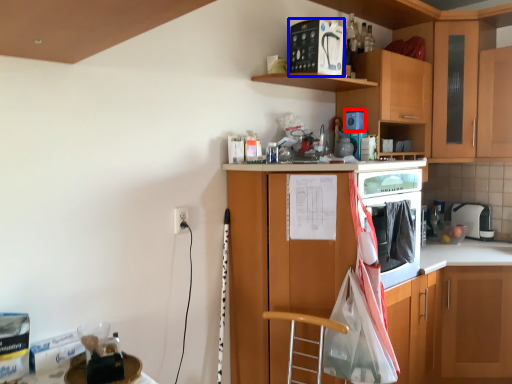
Question: Among these objects, which one is farthest to the camera, appliance (highlighted by a red box) or appliance (highlighted by a blue box)?

Choices:
 (A) appliance
 (B) appliance

Answer: (A)